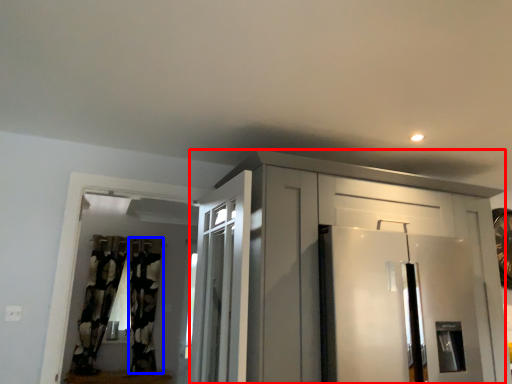
Question: Which object is closer to the camera taking this photo, cabinetry (highlighted by a red box) or curtain (highlighted by a blue box)?

Choices:
 (A) cabinetry
 (B) curtain

Answer: (A)